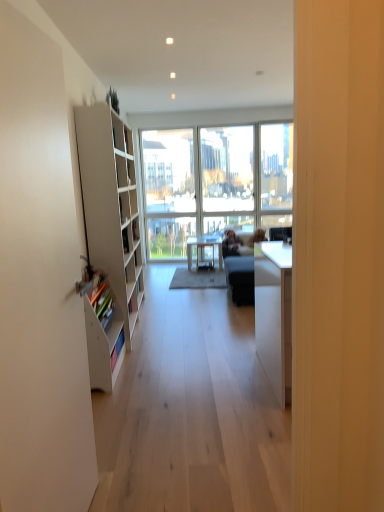
Image resolution: width=384 pixels, height=512 pixels. What are the coordinates of `white matte bookshelf at left` in the screenshot? It's located at (103, 338).

Measure the distance between white matte cabinet at left and camera.

They are 1.93 meters apart.

What is the approximate width of matte white table at center?

matte white table at center is 57.04 centimeters wide.

Identify the location of light brown leather couch at center. This screenshot has width=384, height=512. (257, 237).

At what (x,y) coordinates should I click in order to perform the action: click on white matte screen door at left. Please return your answer as a coordinate pair (x, y). Looking at the image, I should click on (42, 270).

Is light brown leather couch at center positioned far away from white matte cabinet at left?

Yes, light brown leather couch at center and white matte cabinet at left are quite far apart.

Could you tell me if light brown leather couch at center is facing white matte cabinet at left?

No, light brown leather couch at center is not turned towards white matte cabinet at left.

Which is more to the left, light brown leather couch at center or white matte cabinet at left?

From the viewer's perspective, white matte cabinet at left appears more on the left side.

Which is behind, point (248, 244) or point (133, 164)?

Positioned behind is point (248, 244).

Does matte white table at center appear on the left side of white matte bookshelf at left?

In fact, matte white table at center is to the right of white matte bookshelf at left.

Is matte white table at center facing away from white matte bookshelf at left?

No, white matte bookshelf at left is not at the back of matte white table at center.

Is matte white table at center inside or outside of white matte bookshelf at left?

matte white table at center is spatially situated outside white matte bookshelf at left.

From a real-world perspective, between matte white table at center and white matte bookshelf at left, who is vertically higher?

In real-world perspective, white matte bookshelf at left is above.

Is white matte bookshelf at left completely or partially outside of white matte cabinet at left?

Absolutely, white matte bookshelf at left is external to white matte cabinet at left.

From a real-world perspective, is white matte bookshelf at left located higher than white matte cabinet at left?

No, from a real-world perspective, white matte bookshelf at left is not on top of white matte cabinet at left.

Is white matte cabinet at left at the back of white matte bookshelf at left?

white matte bookshelf at left does not have its back to white matte cabinet at left.

Is point (100, 282) in front of point (138, 237)?

Yes.

Considering the relative sizes of matte white table at center and transparent glass window at center in the image provided, is matte white table at center wider than transparent glass window at center?

Yes.

From a real-world perspective, is matte white table at center positioned over transparent glass window at center based on gravity?

Incorrect, from a real-world perspective, matte white table at center is lower than transparent glass window at center.

Which object is more forward, matte white table at center or transparent glass window at center?

matte white table at center is closer to the camera.

From the picture: Would you say matte white table at center is inside or outside transparent glass window at center?

matte white table at center cannot be found inside transparent glass window at center.

Which is closer to the camera, (91, 368) or (164, 199)?

Point (91, 368).

Considering the sizes of white matte bookshelf at left and transparent glass window at center in the image, is white matte bookshelf at left bigger or smaller than transparent glass window at center?

Considering their sizes, white matte bookshelf at left takes up less space than transparent glass window at center.

Is white matte bookshelf at left turned away from transparent glass window at center?

No, white matte bookshelf at left's orientation is not away from transparent glass window at center.

From the image's perspective, would you say white matte bookshelf at left is positioned over transparent glass window at center?

No, from the image's perspective, white matte bookshelf at left is not on top of transparent glass window at center.

Is matte white table at center looking in the opposite direction of light brown leather couch at center?

No, light brown leather couch at center is not at the back of matte white table at center.

Which object is wider, matte white table at center or light brown leather couch at center?

matte white table at center.

From the image's perspective, between matte white table at center and light brown leather couch at center, who is located below?

matte white table at center.

Is matte white table at center not close to light brown leather couch at center?

No, matte white table at center is not far away from light brown leather couch at center.

Based on the photo, is white matte screen door at left not within transparent glass window at center?

Yes, white matte screen door at left is not within transparent glass window at center.

In terms of height, does white matte screen door at left look taller or shorter compared to transparent glass window at center?

white matte screen door at left is shorter than transparent glass window at center.

This screenshot has height=512, width=384. I want to click on window that is on the right side of white matte screen door at left, so click(x=214, y=182).

From the image's perspective, is white matte screen door at left located above or below transparent glass window at center?

Clearly, from the image's perspective, white matte screen door at left is below transparent glass window at center.

The image size is (384, 512). In order to click on cabinet on the left of light brown leather couch at center in this screenshot , I will do `click(110, 232)`.

Locate an element on the screen. shelf that appears in front of the matte white table at center is located at coordinates (103, 338).

When comparing their distances from light brown leather couch at center, does white matte cabinet at left or white matte screen door at left seem further?

Among the two, white matte screen door at left is located further to light brown leather couch at center.

Considering their positions, is white matte bookshelf at left positioned closer to white matte screen door at left than white matte cabinet at left?

Based on the image, white matte bookshelf at left appears to be nearer to white matte screen door at left.

From the image, which object appears to be nearer to white matte bookshelf at left, white matte cabinet at left or transparent glass window at center?

Based on the image, white matte cabinet at left appears to be nearer to white matte bookshelf at left.

Which object lies nearer to the anchor point light brown leather couch at center, white matte cabinet at left or white matte bookshelf at left?

Based on the image, white matte cabinet at left appears to be nearer to light brown leather couch at center.

Based on their spatial positions, is light brown leather couch at center or matte white table at center further from white matte bookshelf at left?

Among the two, matte white table at center is located further to white matte bookshelf at left.

Based on their spatial positions, is transparent glass window at center or white matte screen door at left further from white matte cabinet at left?

The object further to white matte cabinet at left is transparent glass window at center.

Considering their positions, is transparent glass window at center positioned further to white matte bookshelf at left than white matte cabinet at left?

transparent glass window at center is further to white matte bookshelf at left.

Considering their positions, is white matte bookshelf at left positioned closer to transparent glass window at center than white matte cabinet at left?

The object closer to transparent glass window at center is white matte cabinet at left.

At what (x,y) coordinates should I click in order to perform the action: click on table between white matte screen door at left and transparent glass window at center in the front-back direction. Please return your answer as a coordinate pair (x, y). Looking at the image, I should click on (204, 246).

Identify the location of table between white matte cabinet at left and light brown leather couch at center along the z-axis. This screenshot has height=512, width=384. (204, 246).

Find the location of a particular element. table between white matte cabinet at left and transparent glass window at center along the z-axis is located at coordinates (204, 246).

You are a GUI agent. You are given a task and a screenshot of the screen. Output one action in this format:
    pyautogui.click(x=<x>, y=<y>)
    Task: Click on the cabinet located between white matte bookshelf at left and matte white table at center in the depth direction
    The image size is (384, 512).
    Given the screenshot: What is the action you would take?
    pyautogui.click(x=110, y=232)